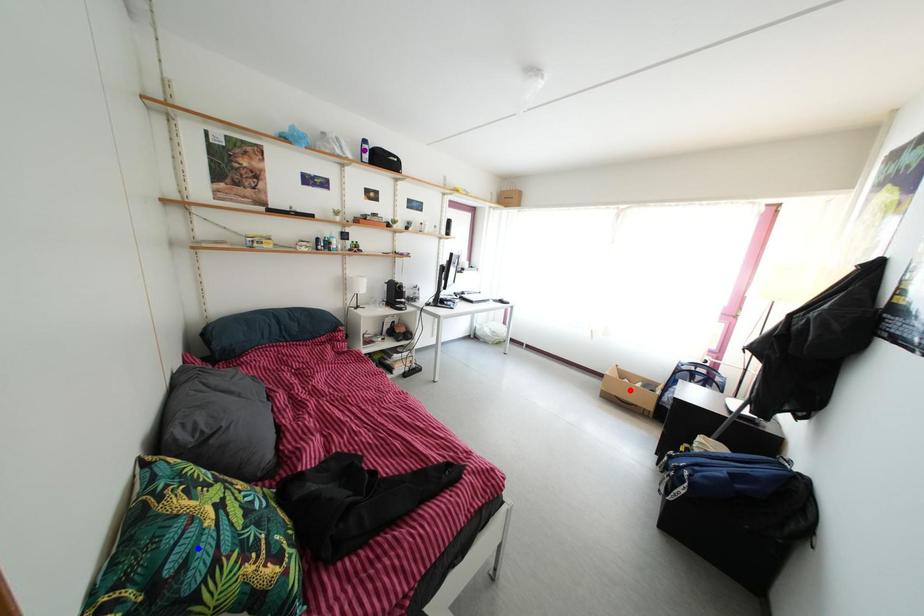
Order these from nearest to farthest:
purple point
red point
blue point

red point, purple point, blue point